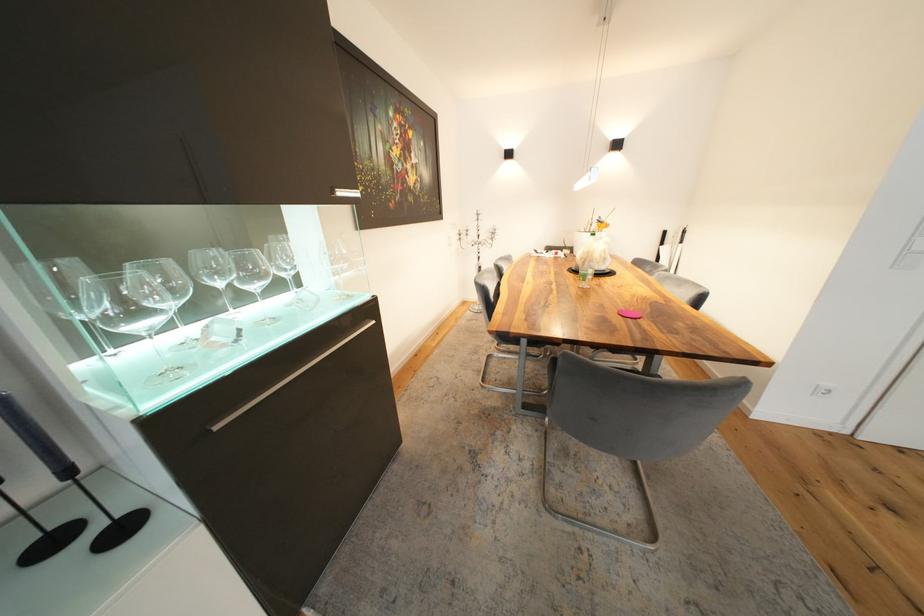
Identify the location of pink coaster. The height and width of the screenshot is (616, 924). [628, 314].